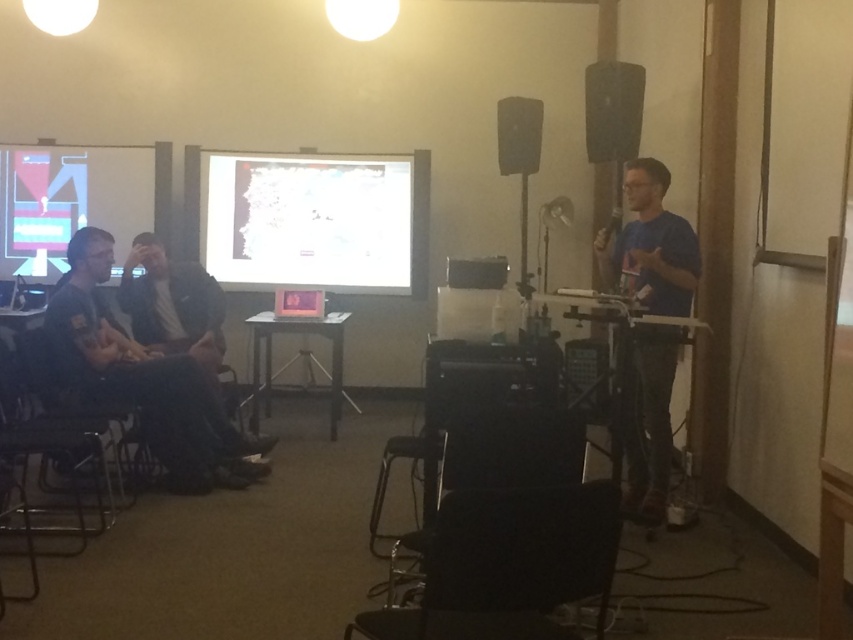
In the presentation room scene, you notice a blue cotton shirt at right and a matte plastic projection screen at upper left. Which object has a greater height in the image?

The blue cotton shirt at right is taller than the matte plastic projection screen at upper left according to the description.

You are an attendee at the presentation and need to locate the blue cotton shirt at right and the black matte speaker at upper right. Which object is bigger in size?

The blue cotton shirt at right is larger in size than the black matte speaker at upper right.